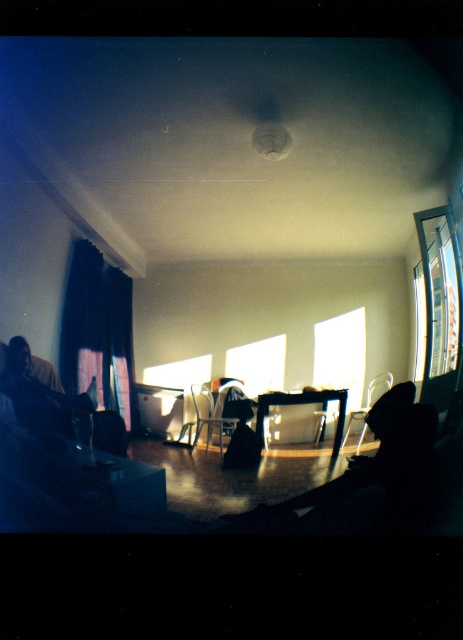
Question: Among these points, which one is farthest from the camera?

Choices:
 (A) (216, 410)
 (B) (362, 435)

Answer: (B)

Question: Does silhouette figure at lower right appear on the left side of dark fabric couch at left?

Choices:
 (A) yes
 (B) no

Answer: (B)

Question: Among these points, which one is nearest to the camera?

Choices:
 (A) (392, 376)
 (B) (356, 312)
 (C) (460, 284)
 (D) (27, 346)

Answer: (B)

Question: Does silhouette figure at lower right appear over dark fabric couch at left?

Choices:
 (A) yes
 (B) no

Answer: (B)

Question: Considering the real-world distances, which object is closest to the dark fabric couch at left?

Choices:
 (A) transparent plastic chair at center
 (B) silhouette figure at lower right

Answer: (B)

Question: Is transparent glass window at center positioned before transparent plastic chair at center?

Choices:
 (A) no
 (B) yes

Answer: (B)